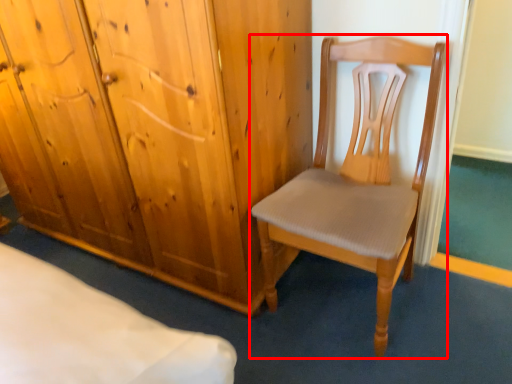
Question: From the image's perspective, where is chair (annotated by the red box) located relative to cupboard?

Choices:
 (A) below
 (B) above

Answer: (A)